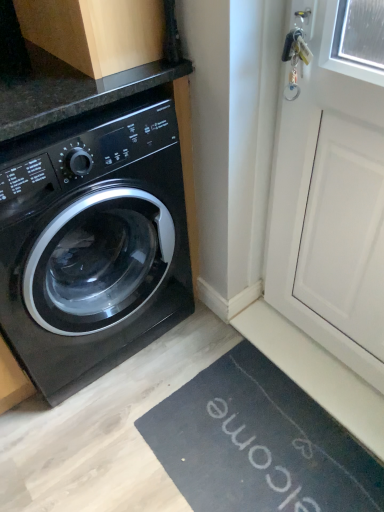
Locate an element on the screen. vacant area on top of black rubber bath mat at lower right (from a real-world perspective) is located at coordinates (266, 443).